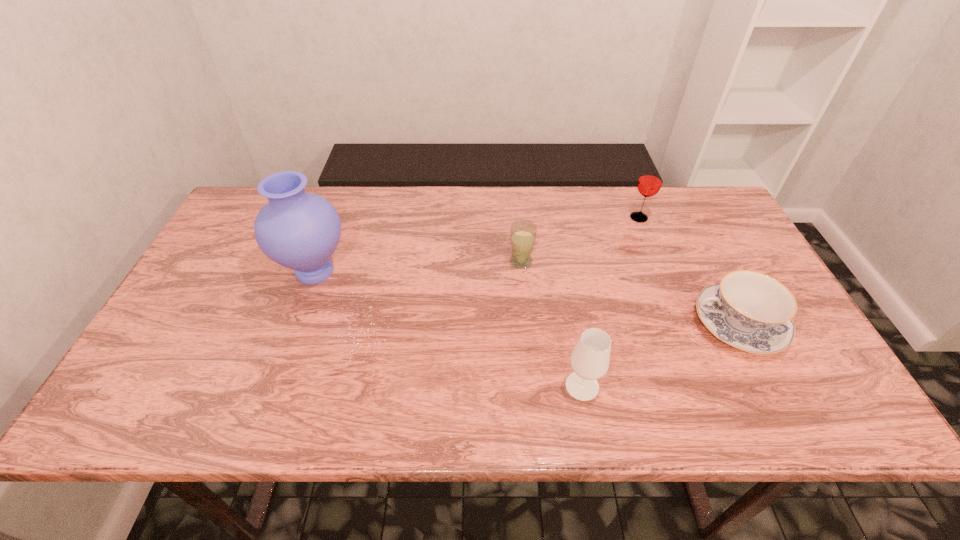
Find the location of a particular element. free spot at the near edge of the desktop is located at coordinates (196, 406).

You are a GUI agent. You are given a task and a screenshot of the screen. Output one action in this format:
    pyautogui.click(x=<x>, y=<y>)
    Task: Click on the blank space at the left edge
    Image resolution: width=960 pixels, height=540 pixels.
    Given the screenshot: What is the action you would take?
    pyautogui.click(x=145, y=376)

Find the location of `free region at the right edge of the desktop`. free region at the right edge of the desktop is located at coordinates (774, 369).

Where is `free space between the rightmost glass and the chinaware`? free space between the rightmost glass and the chinaware is located at coordinates (688, 271).

Locate an element on the screen. This screenshot has width=960, height=540. free point between the nearest object and the farthest glass is located at coordinates (611, 302).

What are the coordinates of `free area in between the farthest object and the chinaware` in the screenshot? It's located at (688, 271).

You are a GUI agent. You are given a task and a screenshot of the screen. Output one action in this format:
    pyautogui.click(x=<x>, y=<y>)
    Task: Click on the vacant space in between the leftmost glass and the leftmost object
    
    Given the screenshot: What is the action you would take?
    pyautogui.click(x=418, y=266)

Where is `unoccupied area between the nearest glass and the chinaware`? Image resolution: width=960 pixels, height=540 pixels. unoccupied area between the nearest glass and the chinaware is located at coordinates (660, 355).

Where is `free space between the vase and the farthest glass`? free space between the vase and the farthest glass is located at coordinates (477, 245).

This screenshot has height=540, width=960. I want to click on free space that is in between the shortest glass and the chinaware, so click(629, 293).